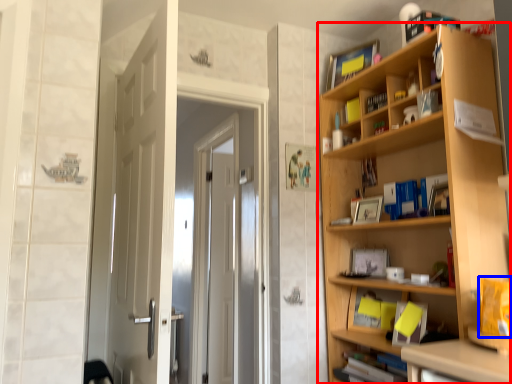
Question: Which of the following is the closest to the observer, bookcase (highlighted by a red box) or book (highlighted by a blue box)?

Choices:
 (A) bookcase
 (B) book

Answer: (B)